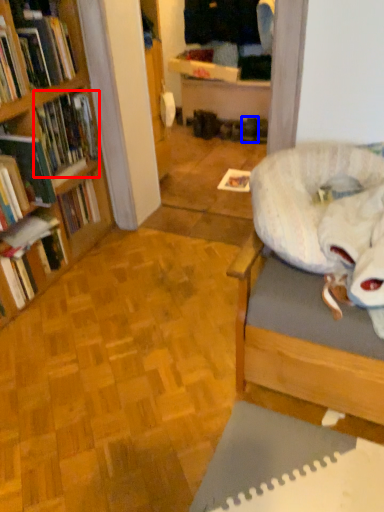
Question: Which object appears farthest to the camera in this image, book (highlighted by a red box) or footwear (highlighted by a blue box)?

Choices:
 (A) book
 (B) footwear

Answer: (B)